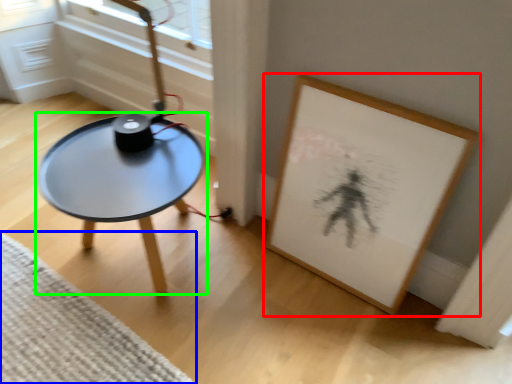
Question: Which is farther away from picture frame (highlighted by a red box)? mat (highlighted by a blue box) or coffee table (highlighted by a green box)?

Choices:
 (A) mat
 (B) coffee table

Answer: (A)